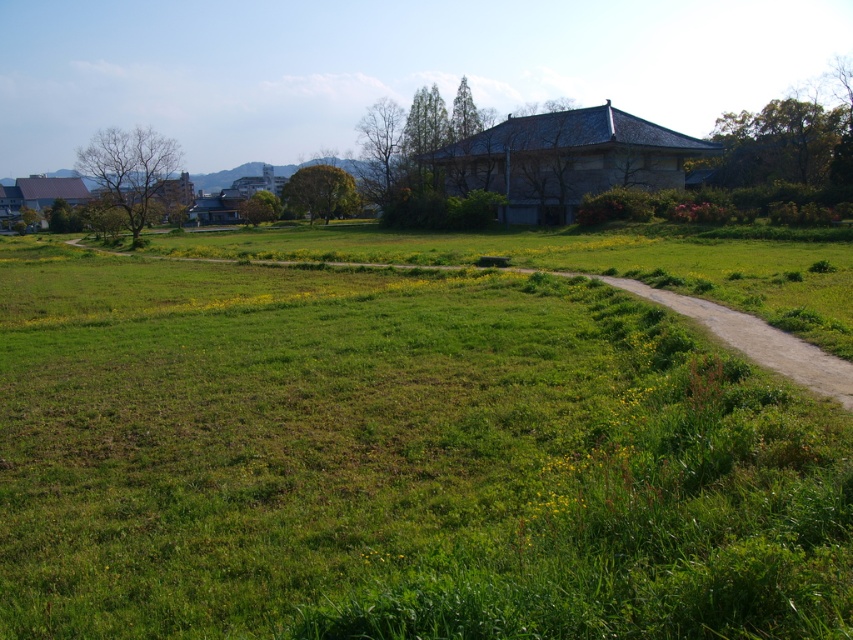
Is green grassy field at center above green grassy trail at center?

No.

Who is higher up, green grassy field at center or green grassy trail at center?

green grassy trail at center is above.

Which is in front, point (302, 323) or point (811, 365)?

Positioned in front is point (811, 365).

Where is `green grassy field at center`? green grassy field at center is located at coordinates (398, 460).